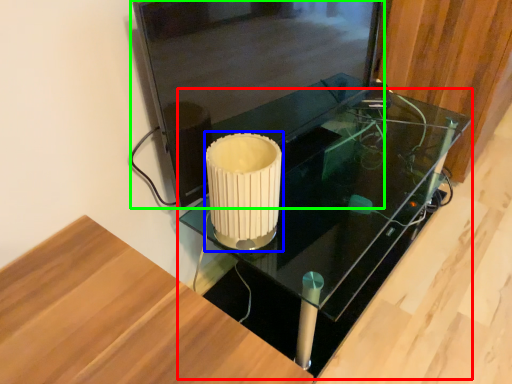
Question: Which object is positioned farthest from table (highlighted by a red box)? Select from candle holder (highlighted by a blue box) and glass door (highlighted by a green box).

Choices:
 (A) candle holder
 (B) glass door

Answer: (A)